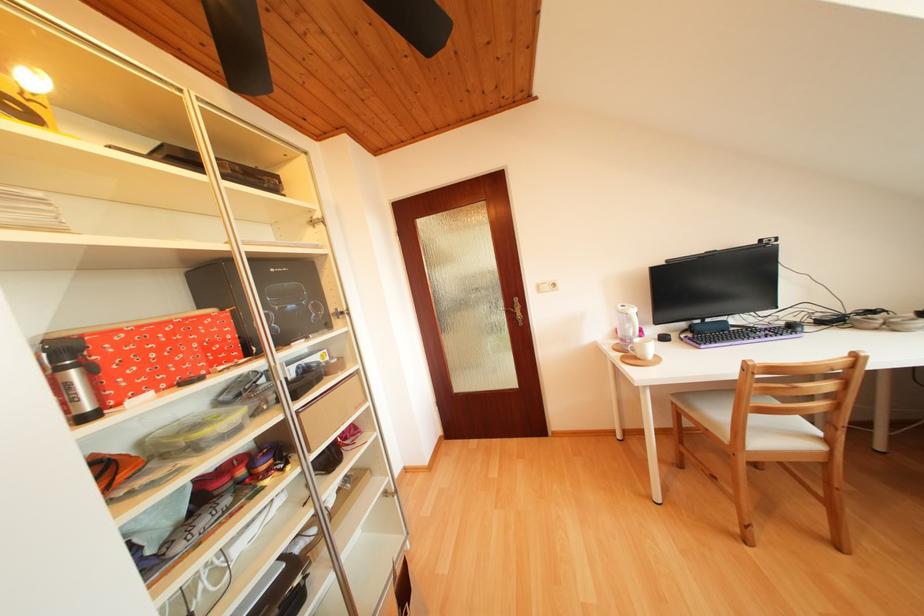
What do you see at coordinates (715, 283) in the screenshot?
I see `the black webcam` at bounding box center [715, 283].